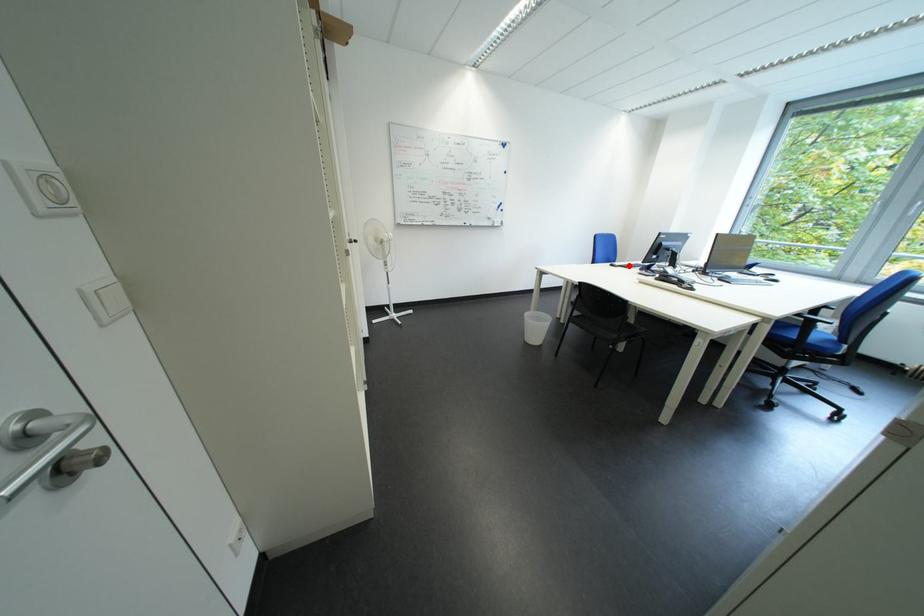
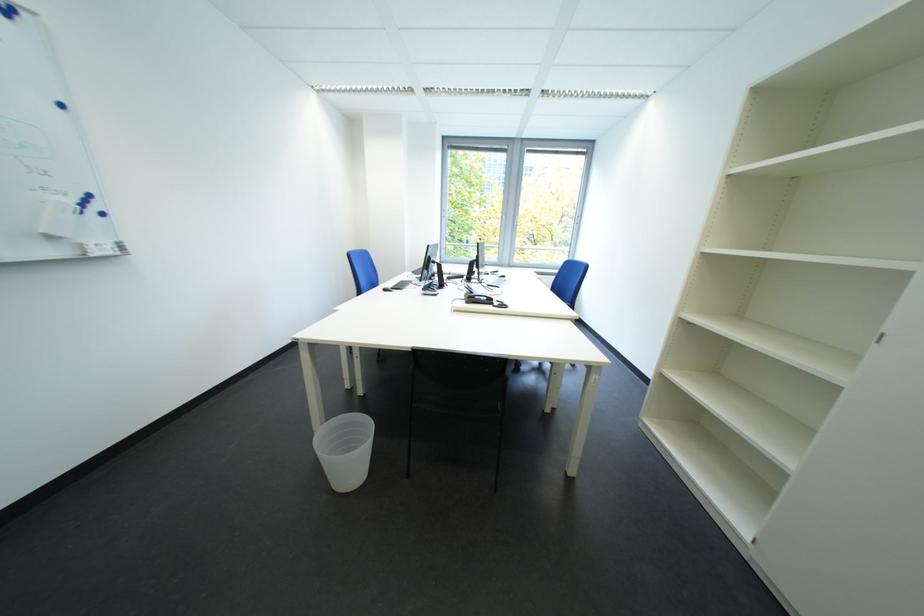
Where in the second image is the point corresponding to the highlighted location from the first image?

(402, 288)